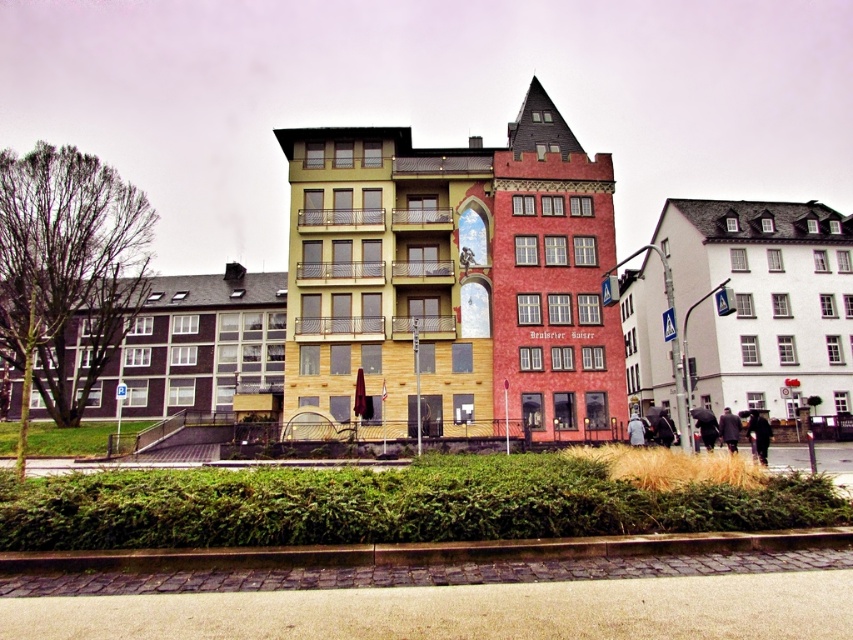
Between green leafy hedge at lower center and dark blue jacket at lower right, which one appears on the right side from the viewer's perspective?

Positioned to the right is dark blue jacket at lower right.

Who is lower down, green leafy hedge at lower center or dark blue jacket at lower right?

dark blue jacket at lower right

Who is more distant from viewer, (x=102, y=515) or (x=647, y=432)?

Point (x=647, y=432)

Where is `green leafy hedge at lower center`? Image resolution: width=853 pixels, height=640 pixels. green leafy hedge at lower center is located at coordinates (399, 502).

Is dark gray jacket at lower right to the right of dark blue jacket at lower right from the viewer's perspective?

Incorrect, dark gray jacket at lower right is not on the right side of dark blue jacket at lower right.

From the picture: Measure the distance between dark gray jacket at lower right and camera.

The distance of dark gray jacket at lower right from camera is 38.32 meters.

Identify the location of dark gray jacket at lower right. Image resolution: width=853 pixels, height=640 pixels. (705, 426).

Based on the photo, between dark gray jacket at lower right and dark gray fabric coat at center, which one is positioned lower?

dark gray fabric coat at center is lower down.

Does dark gray jacket at lower right appear under dark gray fabric coat at center?

No, dark gray jacket at lower right is not below dark gray fabric coat at center.

Is point (706, 442) positioned behind point (663, 433)?

That is False.

I want to click on dark gray jacket at lower right, so click(x=705, y=426).